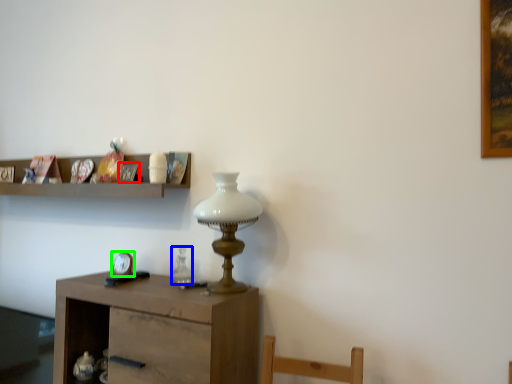
Question: Estimate the real-world distances between objects in this image. Which object is farther from picture frame (highlighted by a red box), glass vase (highlighted by a blue box) or clock (highlighted by a green box)?

Choices:
 (A) glass vase
 (B) clock

Answer: (A)